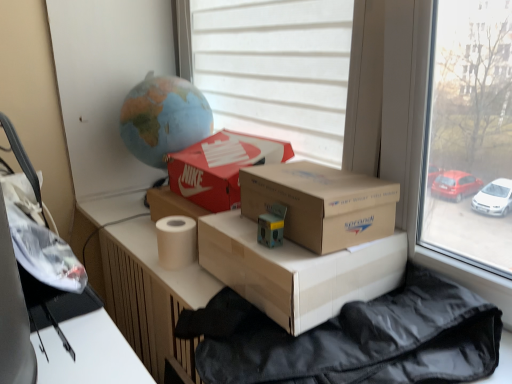
This screenshot has width=512, height=384. Find the location of `vacant area that is situated to the right of matte green plastic toy at center`. vacant area that is situated to the right of matte green plastic toy at center is located at coordinates (339, 251).